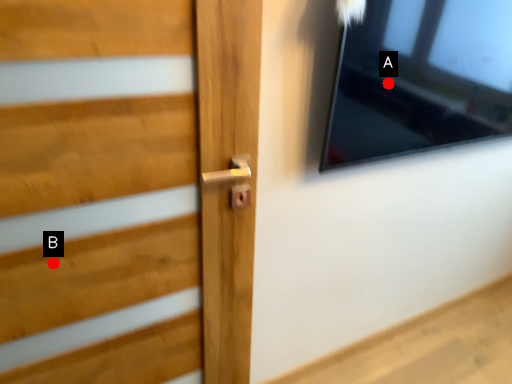
Question: Two points are circled on the image, labeled by A and B beside each circle. Which point is further to the camera?

Choices:
 (A) A is further
 (B) B is further

Answer: (A)